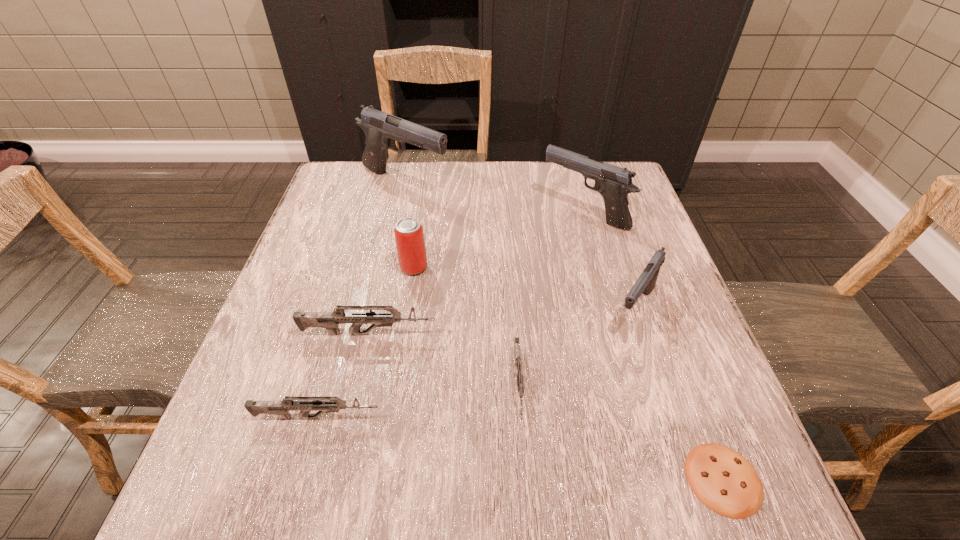
The image size is (960, 540). What are the coordinates of `gun that is the third nearest to the second shortest object` in the screenshot? It's located at tap(281, 408).

Where is `the second closest gun to the cookie`? The image size is (960, 540). the second closest gun to the cookie is located at coordinates (516, 341).

Locate an element on the screen. The image size is (960, 540). black gun identified as the closest to the fourth shortest gun is located at coordinates (614, 183).

Select which black gun is the third closest to the third farthest object. Please provide its 2D coordinates. Your answer should be formatted as a tuple, i.e. [(x, y)], where the tuple contains the x and y coordinates of a point satisfying the conditions above.

[(646, 282)]

Locate which grey gun is the closest to the nearest object. Please provide its 2D coordinates. Your answer should be formatted as a tuple, i.e. [(x, y)], where the tuple contains the x and y coordinates of a point satisfying the conditions above.

[(516, 341)]

Locate an element on the screen. grey gun that is the closest to the fourth shortest object is located at coordinates (516, 341).

Locate an element on the screen. free spot that satisfies the following two spatial constraints: 1. at the muzzle of the fifth shortest gun; 2. on the left side of the shortest object is located at coordinates (658, 479).

At what (x,y) coordinates should I click in order to perform the action: click on blank space that satisfies the following two spatial constraints: 1. at the muzzle of the nearest black gun; 2. aimed along the barrel of the third shortest gun. Please return your answer as a coordinate pair (x, y). This screenshot has height=540, width=960. Looking at the image, I should click on click(x=643, y=334).

Find the location of a particular element. The width and height of the screenshot is (960, 540). free space that satisfies the following two spatial constraints: 1. aimed along the barrel of the second shortest gun; 2. on the right side of the nearest object is located at coordinates (300, 479).

Image resolution: width=960 pixels, height=540 pixels. Identify the location of vacant space that satisfies the following two spatial constraints: 1. at the muzzle of the cookie; 2. on the right side of the second smallest black gun. (658, 479).